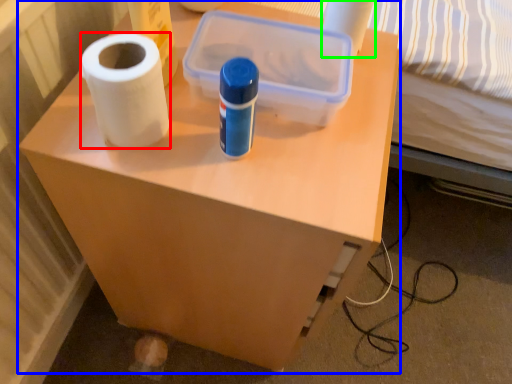
Question: Considering the real-world distances, which object is closest to paper towel (highlighted by a red box)? furniture (highlighted by a blue box) or toilet paper (highlighted by a green box).

Choices:
 (A) furniture
 (B) toilet paper

Answer: (A)